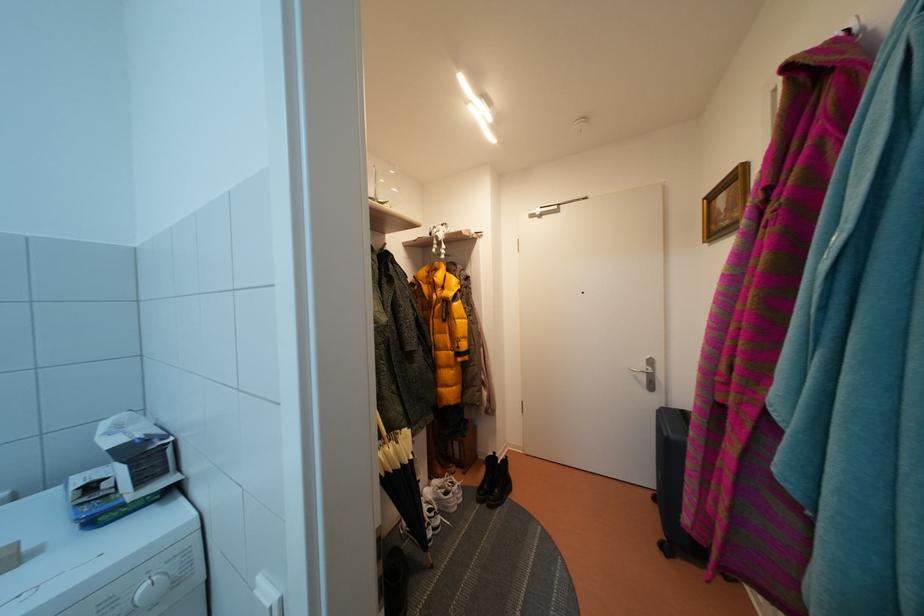
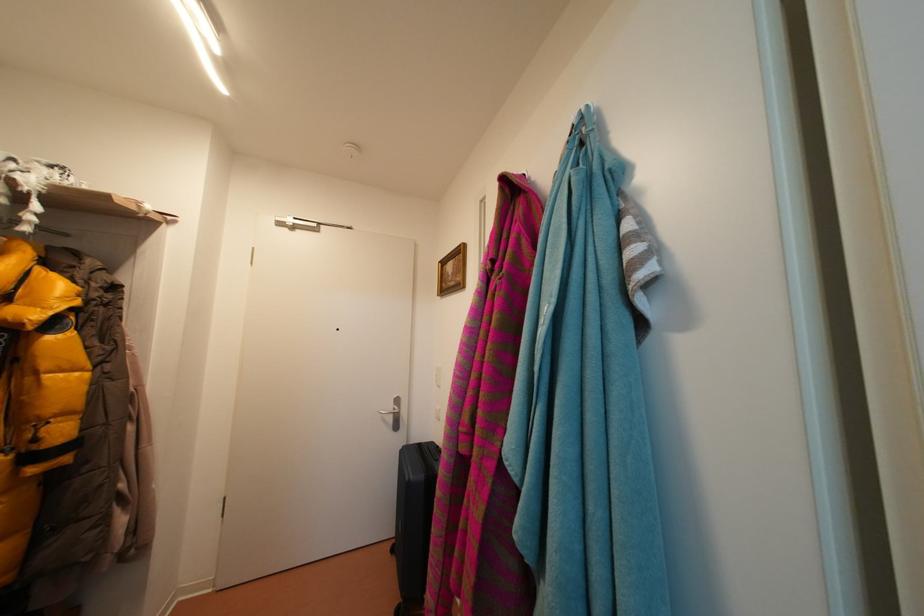
Question: The images are taken continuously from a first-person perspective. In which direction is your viewpoint rotating?

Choices:
 (A) Left
 (B) Right
 (C) Up
 (D) Down

Answer: (B)